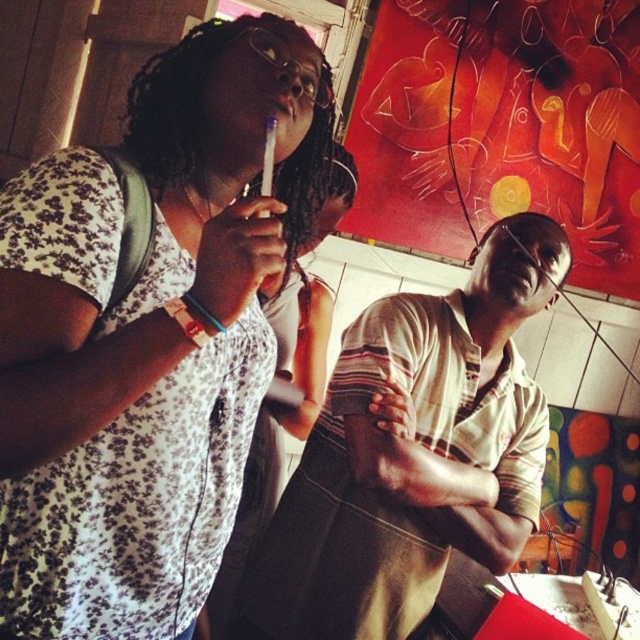
Between floral fabric dress at upper left and matte plastic mouth at center, which one is positioned lower?

floral fabric dress at upper left is lower down.

Can you confirm if floral fabric dress at upper left is smaller than matte plastic mouth at center?

No.

Is point (122, 480) closer to camera compared to point (282, 93)?

Yes.

I want to click on floral fabric dress at upper left, so click(x=147, y=337).

Is floral fabric dress at upper left smaller than matte black shirt at center?

Yes.

Between floral fabric dress at upper left and matte black shirt at center, which one has more height?

matte black shirt at center is taller.

Describe the element at coordinates (147, 337) in the screenshot. I see `floral fabric dress at upper left` at that location.

The height and width of the screenshot is (640, 640). I want to click on floral fabric dress at upper left, so [147, 337].

Is matte black shirt at center in front of matte plastic mouth at center?

No.

Can you confirm if matte black shirt at center is positioned to the left of matte plastic mouth at center?

Indeed, matte black shirt at center is positioned on the left side of matte plastic mouth at center.

Is point (340, 161) farther from camera compared to point (276, 100)?

Yes.

This screenshot has width=640, height=640. I want to click on matte black shirt at center, so click(x=275, y=429).